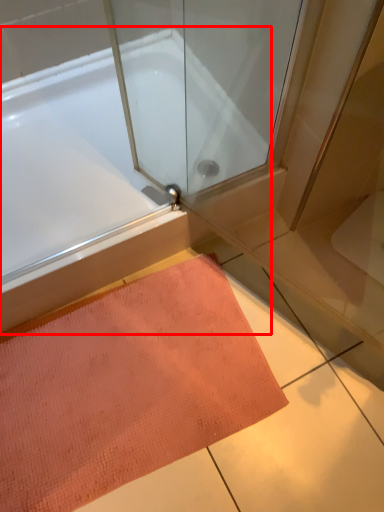
Question: Considering the relative positions of bathtub (annotated by the red box) and doormat in the image provided, where is bathtub (annotated by the red box) located with respect to the staircase?

Choices:
 (A) left
 (B) right

Answer: (A)